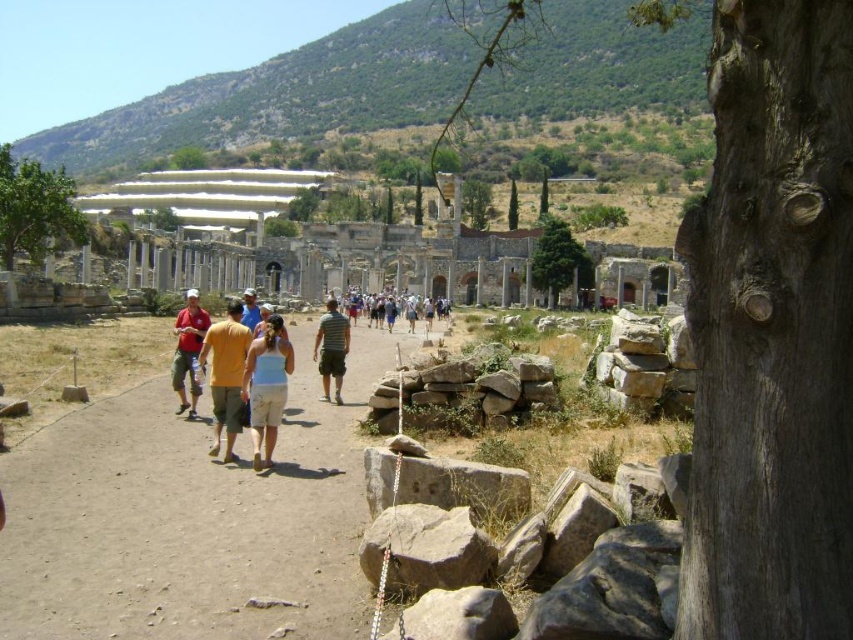
Question: Based on their relative distances, which object is nearer to the light blue t-shirt at center?

Choices:
 (A) striped cotton shirt at center
 (B) yellow cotton shirt at center
 (C) matte red shirt at center
 (D) light blue cotton tank top at center

Answer: (A)

Question: In this image, where is yellow cotton shirt at center located relative to light blue t-shirt at center?

Choices:
 (A) below
 (B) above

Answer: (A)

Question: Among these points, which one is farthest from the camera?

Choices:
 (A) (178, 397)
 (B) (215, 448)
 (C) (370, 304)
 (D) (334, 337)

Answer: (C)

Question: Among these objects, which one is farthest from the camera?

Choices:
 (A) brown dirt path at center
 (B) striped cotton shirt at center
 (C) light blue cotton tank top at center
 (D) yellow cotton shirt at center

Answer: (B)

Question: Can you confirm if striped cotton shirt at center is thinner than light blue t-shirt at center?

Choices:
 (A) yes
 (B) no

Answer: (A)

Question: Is brown dirt path at center behind striped cotton shirt at center?

Choices:
 (A) no
 (B) yes

Answer: (A)